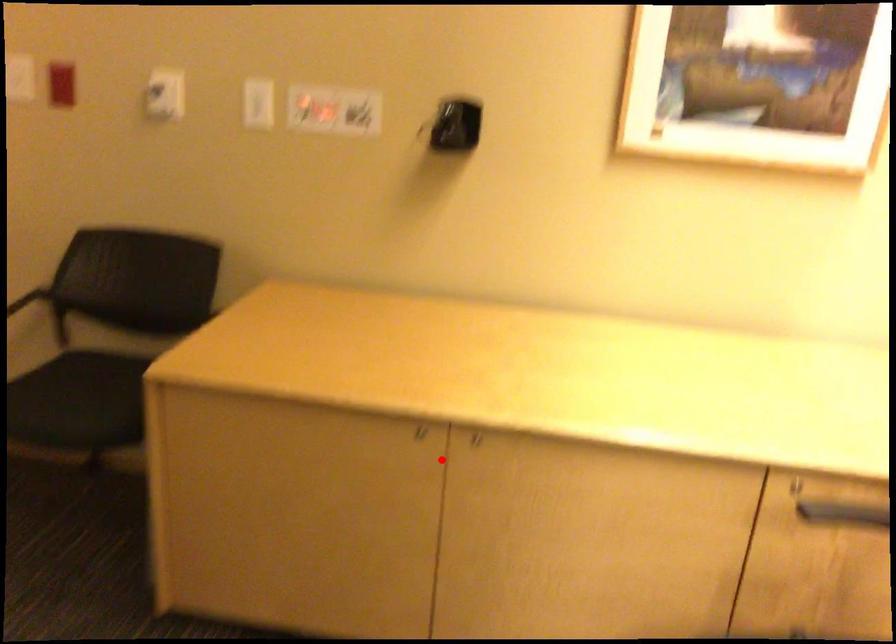
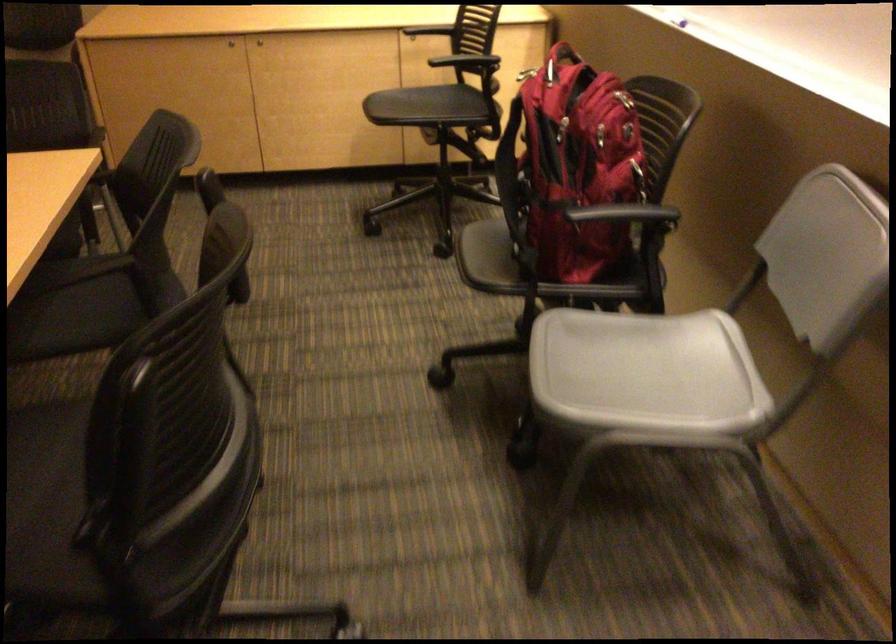
Where in the second image is the point corresponding to the highlighted location from the first image?

(230, 44)